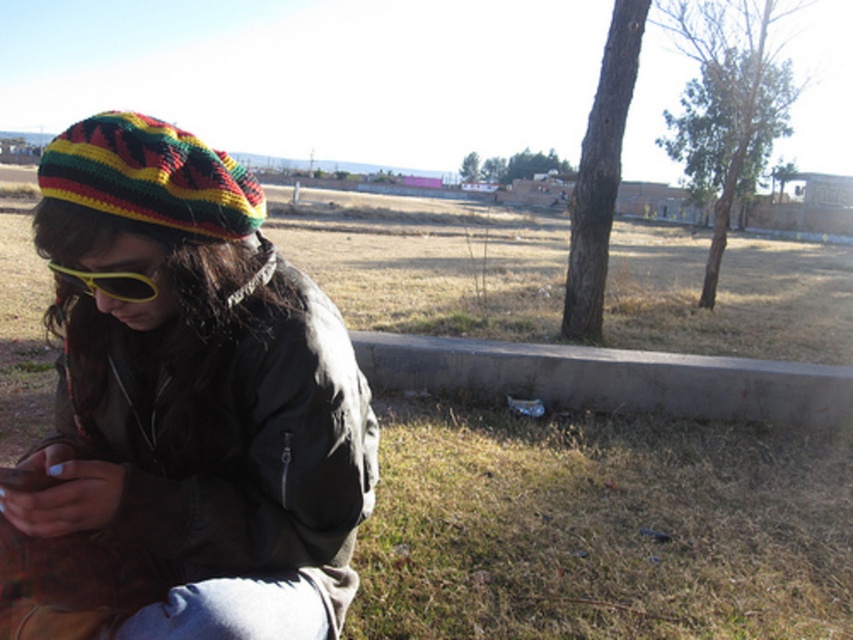
Question: Among these objects, which one is nearest to the camera?

Choices:
 (A) gray concrete curb at lower center
 (B) knitted woolen beanie at upper left
 (C) knitted/rasta-patterned hat at upper left
 (D) white plastic sign at upper right

Answer: (B)

Question: Is gray concrete curb at lower center bigger than yellow matte sunglasses at lower left?

Choices:
 (A) yes
 (B) no

Answer: (A)

Question: In this image, where is green grass at lower center located relative to knitted woolen beanie at upper left?

Choices:
 (A) left
 (B) right

Answer: (B)

Question: Can you confirm if green grass at lower center is bigger than yellow matte sunglasses at lower left?

Choices:
 (A) no
 (B) yes

Answer: (B)

Question: Estimate the real-world distances between objects in this image. Which object is closer to the gray concrete curb at lower center?

Choices:
 (A) knitted/rasta-patterned hat at upper left
 (B) green grass at lower center
 (C) yellow matte sunglasses at lower left

Answer: (A)

Question: Estimate the real-world distances between objects in this image. Which object is closer to the knitted woolen beanie at upper left?

Choices:
 (A) yellow matte sunglasses at lower left
 (B) gray concrete curb at lower center

Answer: (A)